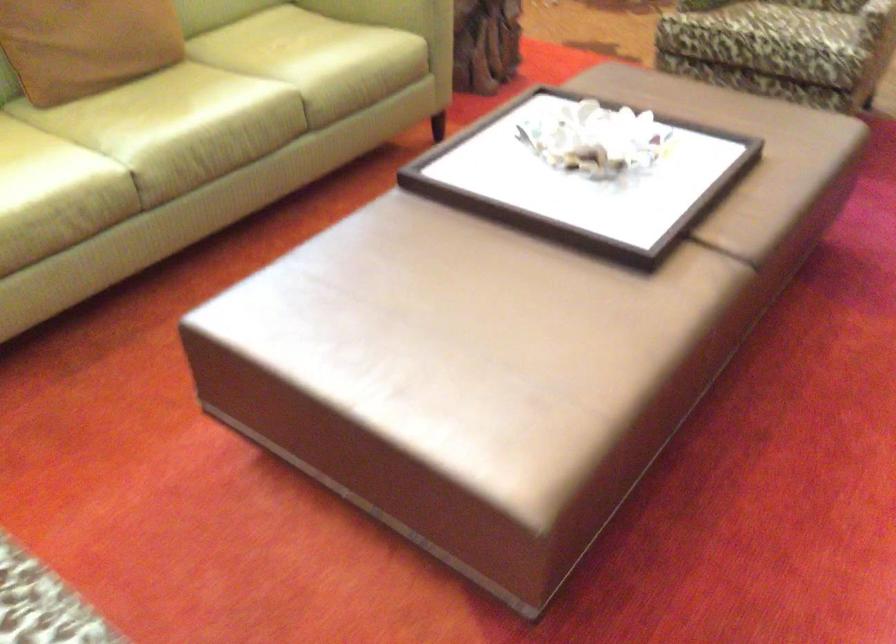
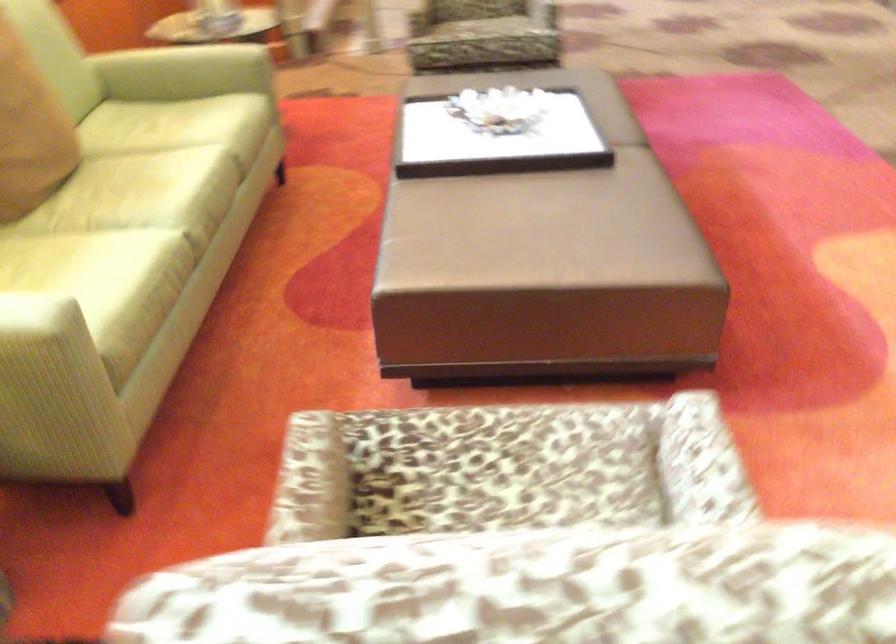
In the second image, find the point that corresponds to (x=131, y=122) in the first image.

(136, 199)